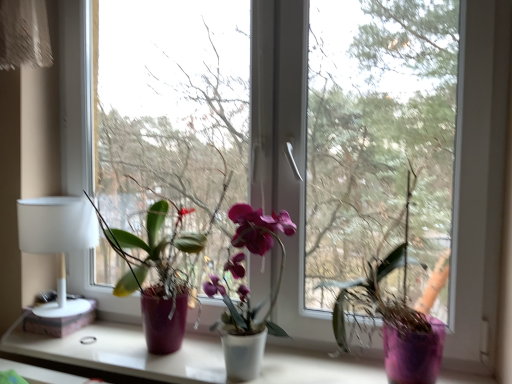
Question: Is purple matte vase at center, the 3th houseplant viewed from the left, turned away from white matte table lamp at left?

Choices:
 (A) yes
 (B) no

Answer: (B)

Question: Is purple matte vase at center, the 3th houseplant viewed from the left, positioned before white matte table lamp at left?

Choices:
 (A) no
 (B) yes

Answer: (B)

Question: Is purple matte vase at center, placed as the 1th houseplant when sorted from right to left, aimed at white matte table lamp at left?

Choices:
 (A) no
 (B) yes

Answer: (A)

Question: From a real-world perspective, is purple matte vase at center, placed as the 1th houseplant when sorted from right to left, under white matte table lamp at left?

Choices:
 (A) no
 (B) yes

Answer: (A)

Question: From a real-world perspective, is purple matte vase at center, the 3th houseplant viewed from the left, positioned over white matte table lamp at left based on gravity?

Choices:
 (A) no
 (B) yes

Answer: (B)

Question: Looking at their shapes, would you say transparent glass window at center, placed as the 2th window screen when sorted from right to left, is wider or thinner than white matte window sill at center?

Choices:
 (A) thin
 (B) wide

Answer: (A)

Question: Is transparent glass window at center, which is counted as the 1th window screen, starting from the left, bigger or smaller than white matte window sill at center?

Choices:
 (A) big
 (B) small

Answer: (A)

Question: From the image's perspective, is transparent glass window at center, which is counted as the 1th window screen, starting from the left, positioned above or below white matte window sill at center?

Choices:
 (A) below
 (B) above

Answer: (B)

Question: From a real-world perspective, is transparent glass window at center, which is counted as the 1th window screen, starting from the left, positioned above or below white matte window sill at center?

Choices:
 (A) above
 (B) below

Answer: (A)

Question: Considering the positions of transparent glass window at center and transparent glass window at center, which is counted as the 1th window screen, starting from the right, in the image, is transparent glass window at center bigger or smaller than transparent glass window at center, which is counted as the 1th window screen, starting from the right,?

Choices:
 (A) small
 (B) big

Answer: (B)

Question: From the image's perspective, is transparent glass window at center located above or below transparent glass window at center, placed as the second window screen when sorted from left to right?

Choices:
 (A) below
 (B) above

Answer: (B)

Question: Which is correct: transparent glass window at center is inside transparent glass window at center, which is counted as the 1th window screen, starting from the right, or outside of it?

Choices:
 (A) outside
 (B) inside

Answer: (A)

Question: Would you say transparent glass window at center is to the left or to the right of transparent glass window at center, which is counted as the 1th window screen, starting from the right, in the picture?

Choices:
 (A) left
 (B) right

Answer: (A)

Question: Based on their positions, is transparent glass window at center, placed as the second window screen when sorted from left to right, located to the left or right of white matte window sill at center?

Choices:
 (A) left
 (B) right

Answer: (B)

Question: From the image's perspective, is transparent glass window at center, which is counted as the 1th window screen, starting from the right, positioned above or below white matte window sill at center?

Choices:
 (A) above
 (B) below

Answer: (A)